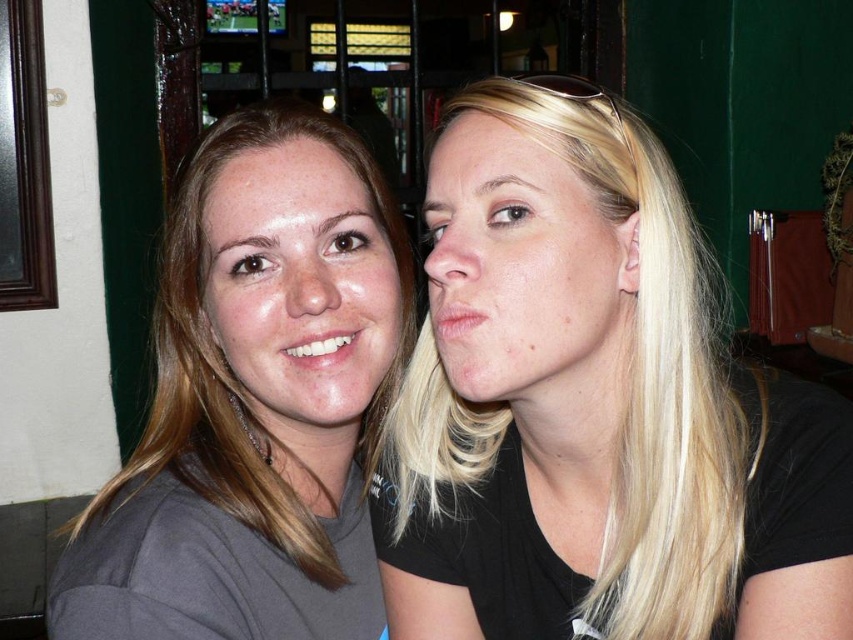
Is point (169, 552) positioned behind point (317, 285)?

No, (169, 552) is in front of (317, 285).

Does matte gray shirt at left have a lesser height compared to matte gray face at center?

No.

Who is more distant from viewer, (x=144, y=541) or (x=357, y=262)?

The point (x=357, y=262) is more distant.

The height and width of the screenshot is (640, 853). What are the coordinates of `matte gray shirt at left` in the screenshot? It's located at (254, 401).

Is blonde hair at center thinner than matte gray face at center?

Incorrect, blonde hair at center's width is not less than matte gray face at center's.

Is blonde hair at center above matte gray face at center?

No, blonde hair at center is not above matte gray face at center.

Identify the location of blonde hair at center. The height and width of the screenshot is (640, 853). (595, 406).

From the picture: Is blonde hair at center shorter than matte gray shirt at left?

Indeed, blonde hair at center has a lesser height compared to matte gray shirt at left.

Is blonde hair at center to the right of matte gray shirt at left from the viewer's perspective?

Yes, blonde hair at center is to the right of matte gray shirt at left.

Which is in front, point (592, 518) or point (224, 321)?

Positioned in front is point (592, 518).

You are a GUI agent. You are given a task and a screenshot of the screen. Output one action in this format:
    pyautogui.click(x=<x>, y=<y>)
    Task: Click on the blonde hair at center
    Image resolution: width=853 pixels, height=640 pixels.
    Given the screenshot: What is the action you would take?
    pyautogui.click(x=595, y=406)